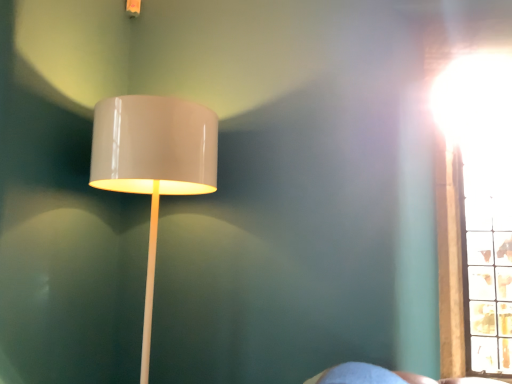
Image resolution: width=512 pixels, height=384 pixels. I want to click on glossy white lampshade at upper left, so click(x=153, y=163).

Describe the element at coordinates (153, 163) in the screenshot. I see `glossy white lampshade at upper left` at that location.

In order to click on glossy white lampshade at upper left in this screenshot , I will do `click(153, 163)`.